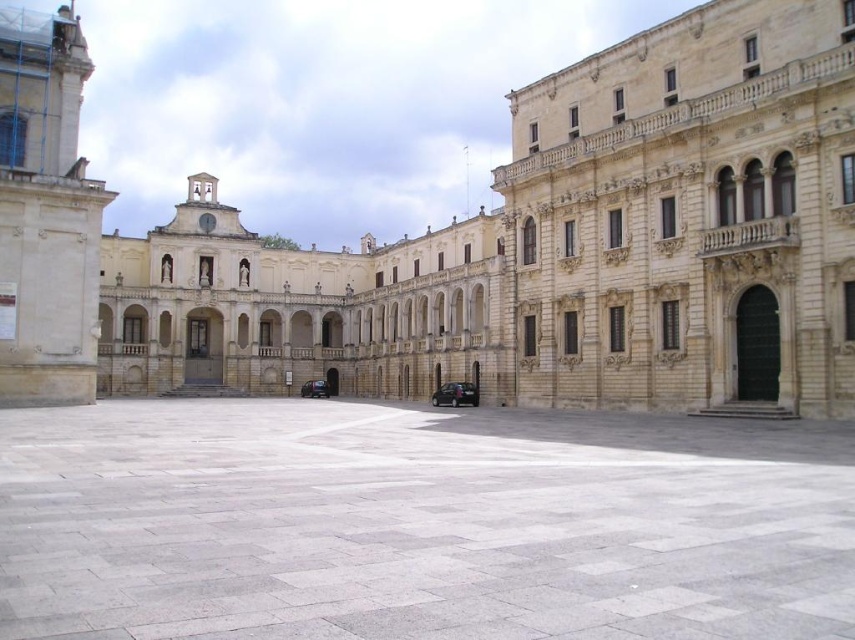
Question: Which object is positioned farthest from the beige stone palace at center?

Choices:
 (A) gray stone courtyard at center
 (B) shiny black car at center

Answer: (A)

Question: Which object appears closest to the camera in this image?

Choices:
 (A) beige stone palace at center
 (B) shiny black car at center
 (C) shiny dark blue car at center
 (D) gray stone courtyard at center

Answer: (D)

Question: Is gray stone courtyard at center in front of shiny black car at center?

Choices:
 (A) no
 (B) yes

Answer: (B)

Question: Which of the following is the closest to the observer?

Choices:
 (A) gray stone courtyard at center
 (B) shiny dark blue car at center
 (C) shiny black car at center
 (D) beige stone palace at center

Answer: (A)

Question: Can you confirm if beige stone palace at center is thinner than shiny dark blue car at center?

Choices:
 (A) no
 (B) yes

Answer: (A)

Question: Can you confirm if beige stone palace at center is smaller than shiny dark blue car at center?

Choices:
 (A) yes
 (B) no

Answer: (B)